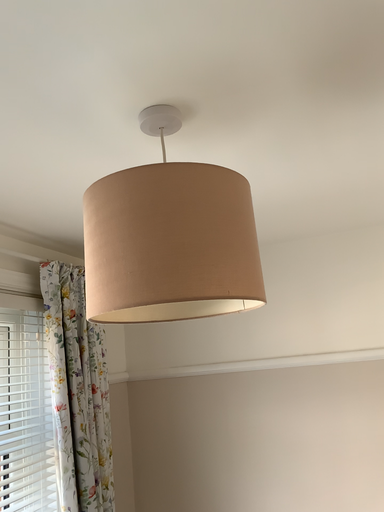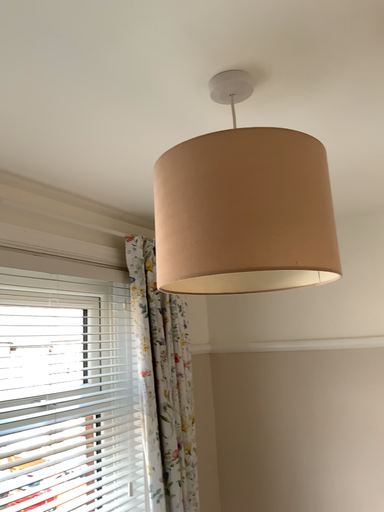
Question: Which way did the camera rotate in the video?

Choices:
 (A) rotated right
 (B) rotated left

Answer: (B)